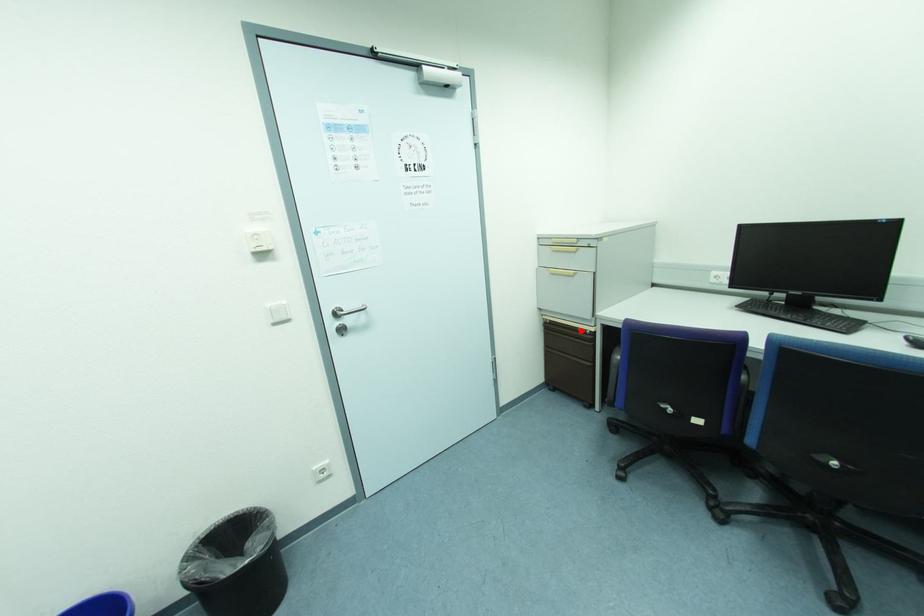
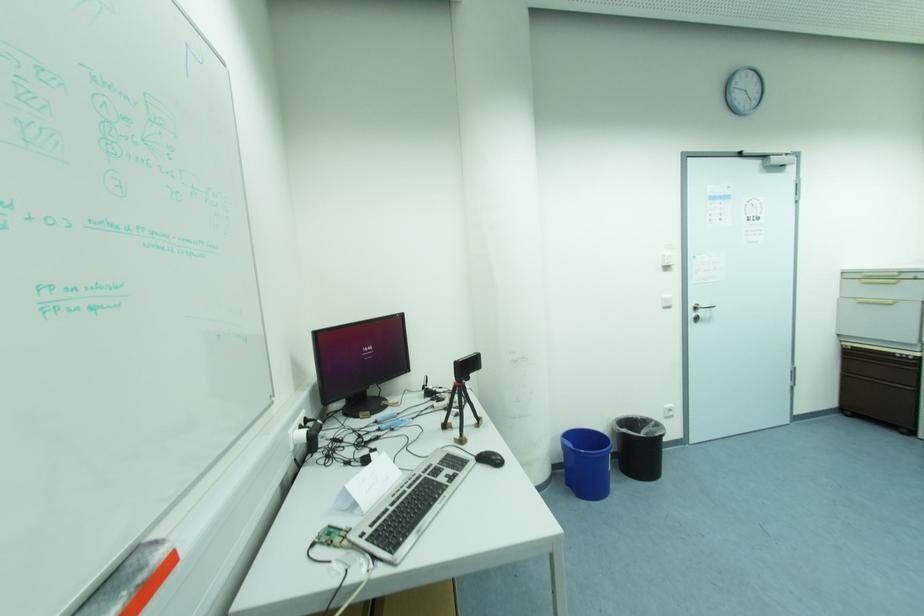
Question: I am providing you with two images of the same scene from different viewpoints. A red point is shown in image1. For the corresponding object point in image2, is it positioned nearer or farther from the camera?

Choices:
 (A) Nearer
 (B) Farther

Answer: (B)